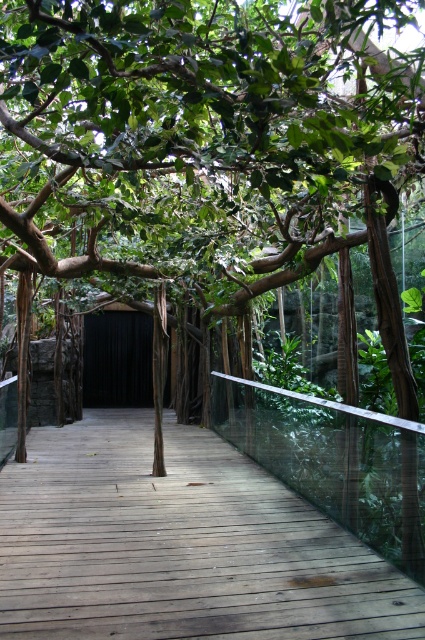
You are standing on the wooden walkway and want to move from the point at coordinates point (119, 273) to the point at coordinates point (88, 472). Since the walkway is narrow, will you have to step backwards or forwards to reach the destination?

Since point (119, 273) is closer to the viewer than point (88, 472), you will need to step forwards to reach the destination.

You are standing on the wooden walkway and see a point marked at coordinates [200,138]. What object is located at that point?

The point at coordinates [200,138] corresponds to the green leafy tree at center.

You are a gardener planning to trim the green leafy tree at center so that it doesn not block the brown wooden path at center. Which part of the tree should you focus on cutting?

The gardener should focus on cutting the branches of the green leafy tree at center that extend over the brown wooden path at center, as the tree is wider than the path and may be encroaching into its space.